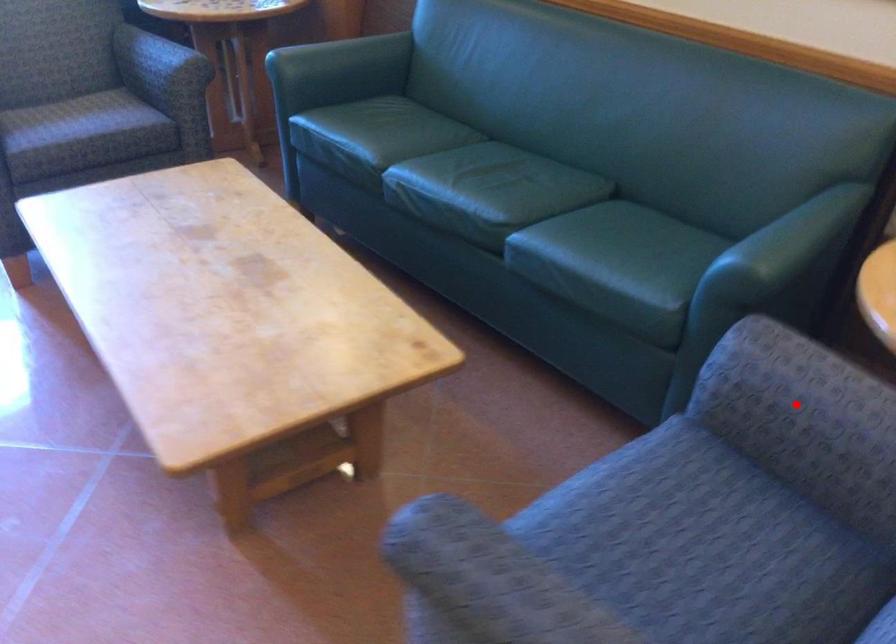
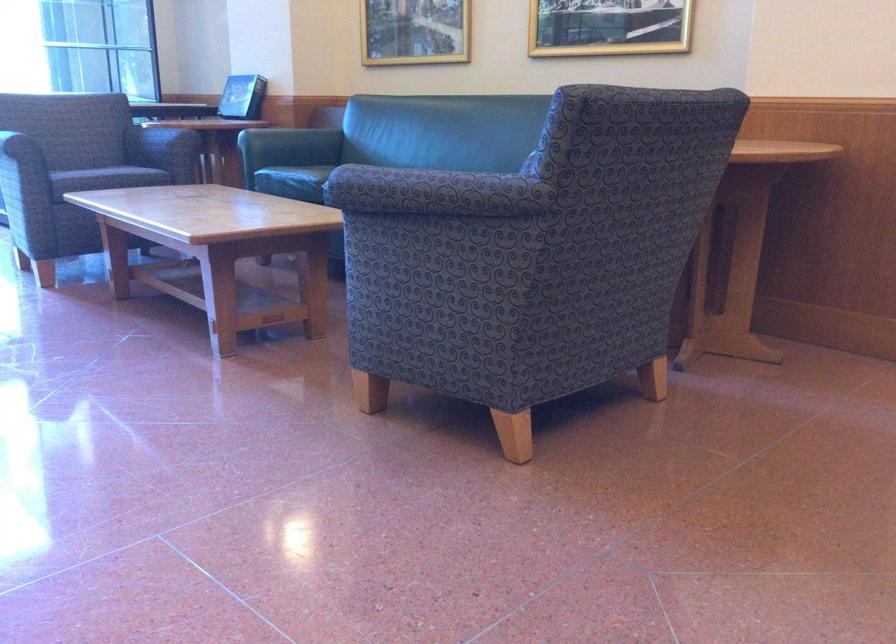
Question: I am providing you with two images of the same scene from different viewpoints. A red point is marked on the first image. Is the red point's position out of view in image 2?

Choices:
 (A) Yes
 (B) No

Answer: (A)